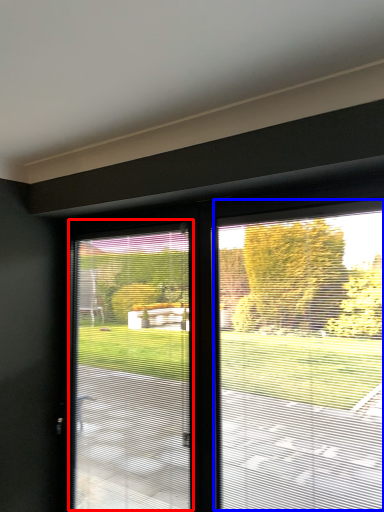
Question: Which object appears farthest to the camera in this image, window screen (highlighted by a red box) or window screen (highlighted by a blue box)?

Choices:
 (A) window screen
 (B) window screen

Answer: (A)